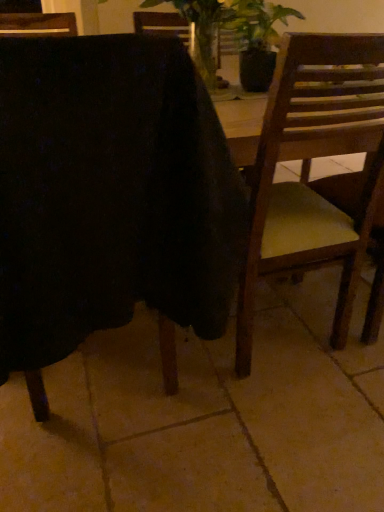
Question: Considering their positions, is wooden chair at center, the 1th chair from the left, located in front of or behind wooden chair at right, which appears as the 1th chair when viewed from the right?

Choices:
 (A) behind
 (B) front

Answer: (B)

Question: Looking at the image, does wooden chair at center, the 2th chair when ordered from right to left, seem bigger or smaller compared to wooden chair at right, which appears as the 1th chair when viewed from the right?

Choices:
 (A) small
 (B) big

Answer: (B)

Question: Is wooden chair at center, the 2th chair when ordered from right to left, taller or shorter than wooden chair at right, which appears as the 1th chair when viewed from the right?

Choices:
 (A) short
 (B) tall

Answer: (A)

Question: Considering the positions of wooden chair at right, which appears as the second chair when viewed from the left, and wooden chair at center, the 1th chair from the left, in the image, is wooden chair at right, which appears as the second chair when viewed from the left, taller or shorter than wooden chair at center, the 1th chair from the left,?

Choices:
 (A) tall
 (B) short

Answer: (A)

Question: From a real-world perspective, relative to wooden chair at center, the 1th chair from the left, is wooden chair at right, which appears as the second chair when viewed from the left, vertically above or below?

Choices:
 (A) below
 (B) above

Answer: (A)

Question: Do you think wooden chair at right, which appears as the second chair when viewed from the left, is within wooden chair at center, the 1th chair from the left, or outside of it?

Choices:
 (A) inside
 (B) outside

Answer: (B)

Question: Is wooden chair at right, which appears as the second chair when viewed from the left, bigger or smaller than wooden chair at center, the 1th chair from the left?

Choices:
 (A) small
 (B) big

Answer: (A)